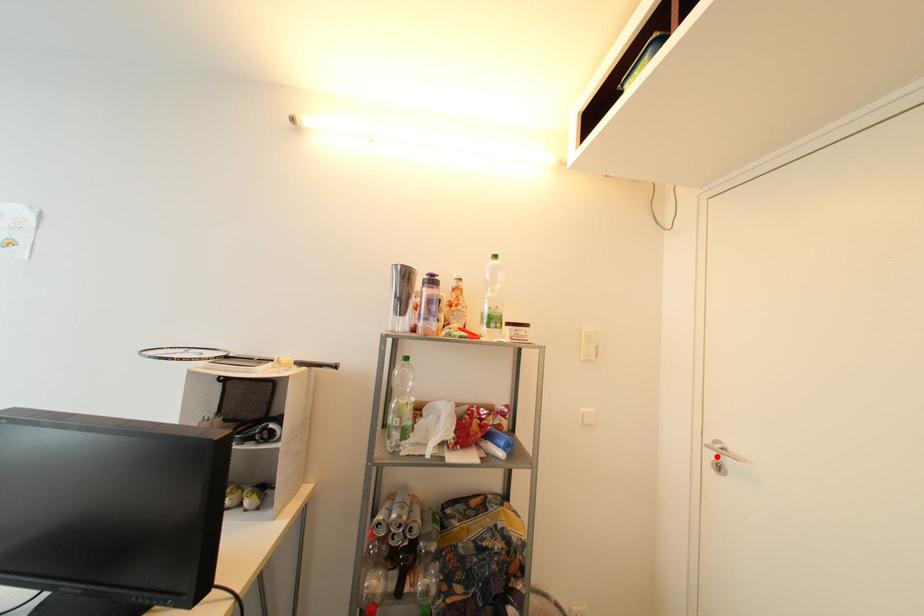
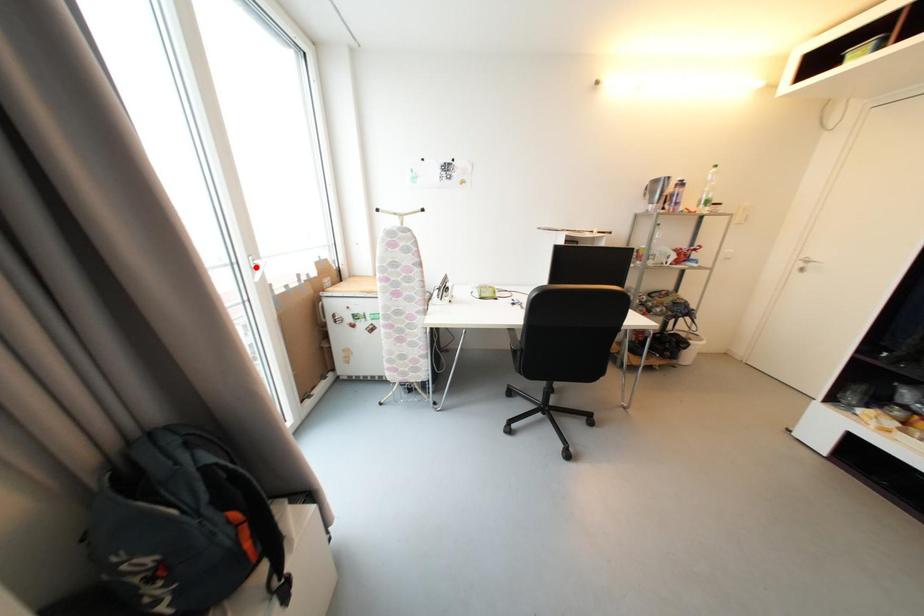
I am providing you with two images of the same scene from different viewpoints. A red point is marked on the first image and another point is marked on the second image. Does the point marked in image1 correspond to the same location as the one in image2?

No